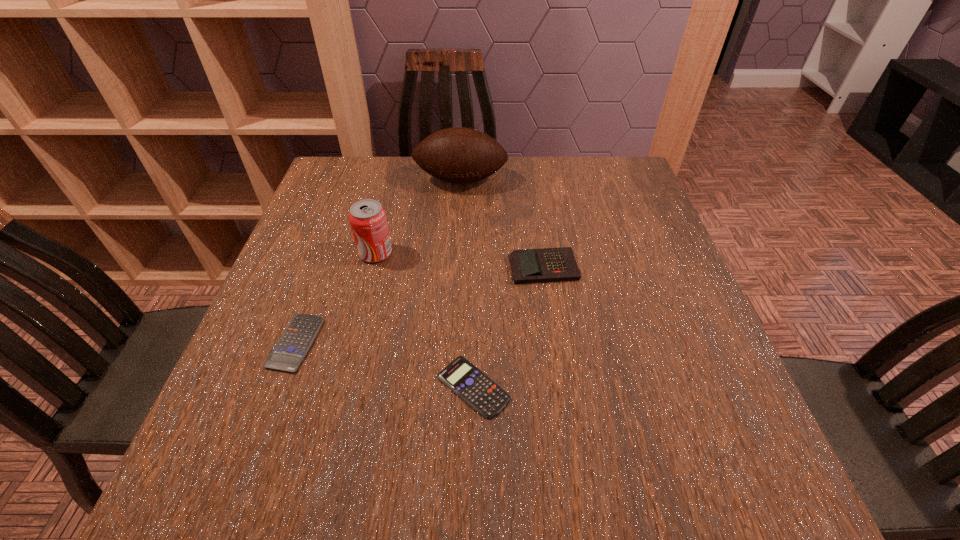
Find the location of a particular element. The image size is (960, 540). vacant area located on the right of the leftmost object is located at coordinates (380, 343).

You are a GUI agent. You are given a task and a screenshot of the screen. Output one action in this format:
    pyautogui.click(x=<x>, y=<y>)
    Task: Click on the object at the far edge
    This screenshot has height=540, width=960.
    Given the screenshot: What is the action you would take?
    pyautogui.click(x=457, y=155)

The width and height of the screenshot is (960, 540). Find the location of `soda can positioned at the left edge`. soda can positioned at the left edge is located at coordinates (367, 218).

Identify the location of calculator that is positioned at the left edge. (287, 355).

At what (x,y) coordinates should I click in order to perform the action: click on free space at the far edge. Please return your answer as a coordinate pair (x, y). Looking at the image, I should click on (407, 168).

This screenshot has height=540, width=960. I want to click on free space at the near edge of the desktop, so click(566, 459).

Image resolution: width=960 pixels, height=540 pixels. In the image, there is a desktop. What are the coordinates of `free region at the left edge` in the screenshot? It's located at (347, 277).

Locate an element on the screen. Image resolution: width=960 pixels, height=540 pixels. free space at the right edge of the desktop is located at coordinates (623, 217).

In the image, there is a desktop. Where is `vacant space at the far left corner`? The height and width of the screenshot is (540, 960). vacant space at the far left corner is located at coordinates click(348, 196).

In the image, there is a desktop. Where is `vacant space at the near right corner`? vacant space at the near right corner is located at coordinates (754, 450).